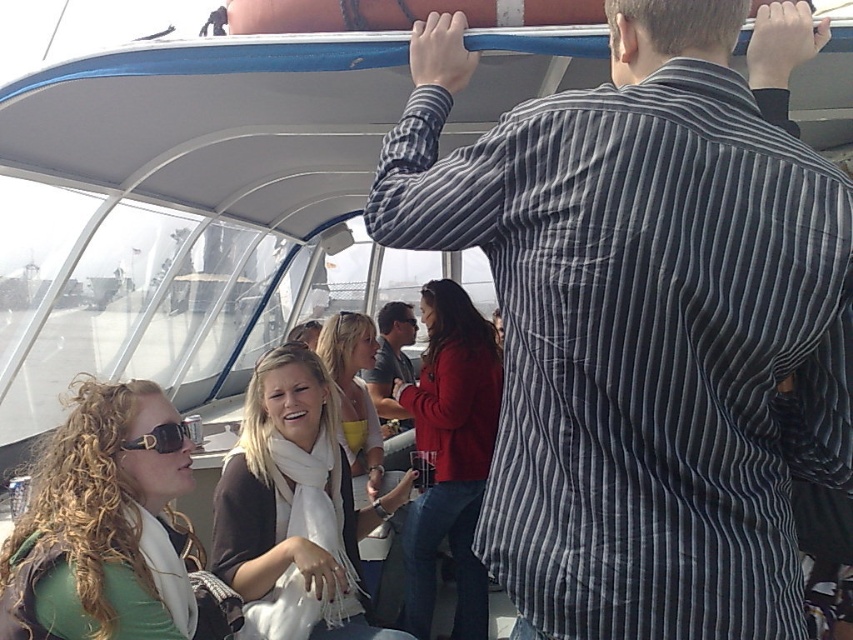
Question: Can you confirm if striped shirt at upper right is positioned below matte gray shirt at center?

Choices:
 (A) yes
 (B) no

Answer: (B)

Question: Which point is closer to the camera?

Choices:
 (A) (274, 385)
 (B) (445, 529)
 (C) (381, 419)
 (D) (140, 573)

Answer: (D)

Question: Which point is closer to the camera taking this photo?

Choices:
 (A) (541, 600)
 (B) (254, 595)

Answer: (A)

Question: Does matte red jacket at center appear under matte gray shirt at center?

Choices:
 (A) yes
 (B) no

Answer: (A)

Question: Is matte red jacket at center to the right of black plastic sunglasses at lower left from the viewer's perspective?

Choices:
 (A) no
 (B) yes

Answer: (B)

Question: Which of the following is the farthest from the observer?

Choices:
 (A) matte red jacket at center
 (B) striped shirt at upper right

Answer: (A)